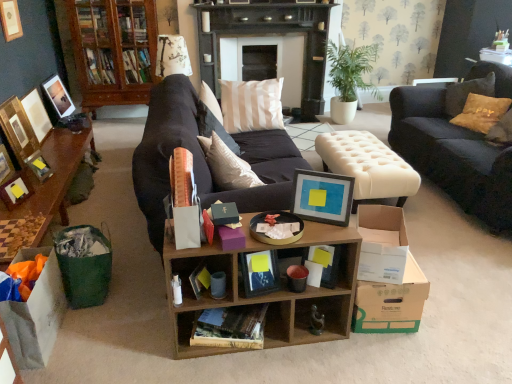
Locate an element on the screen. vacant area on top of cream tufted ottoman at center (from a real-world perspective) is located at coordinates (362, 154).